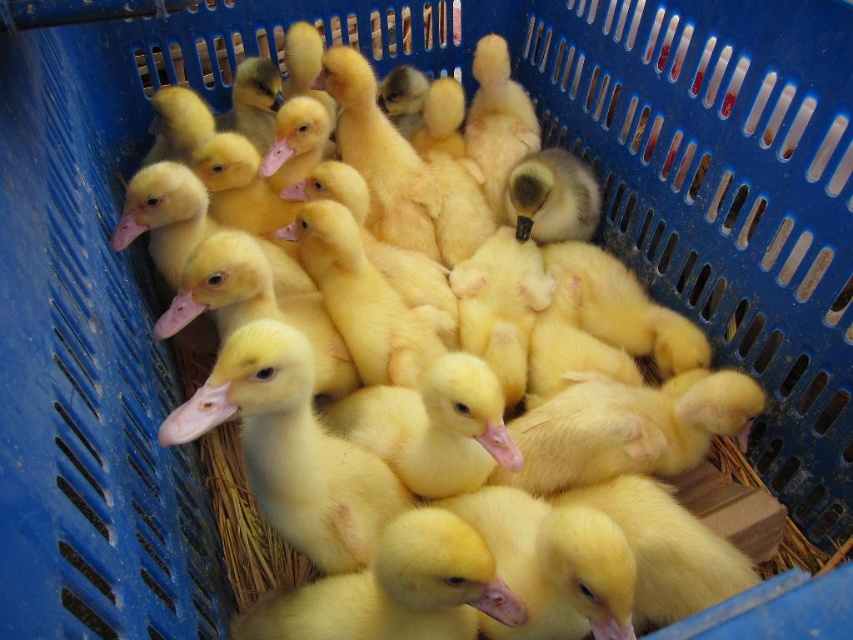
You are a farmer checking the crate of baby ducks. You need to reach the smooth yellow duckling at center without disturbing the others. What coordinate should you aim for to pick it up?

The smooth yellow duckling at center is located at coordinate point (291,448), so you should aim for that coordinate to pick it up without disturbing the others.